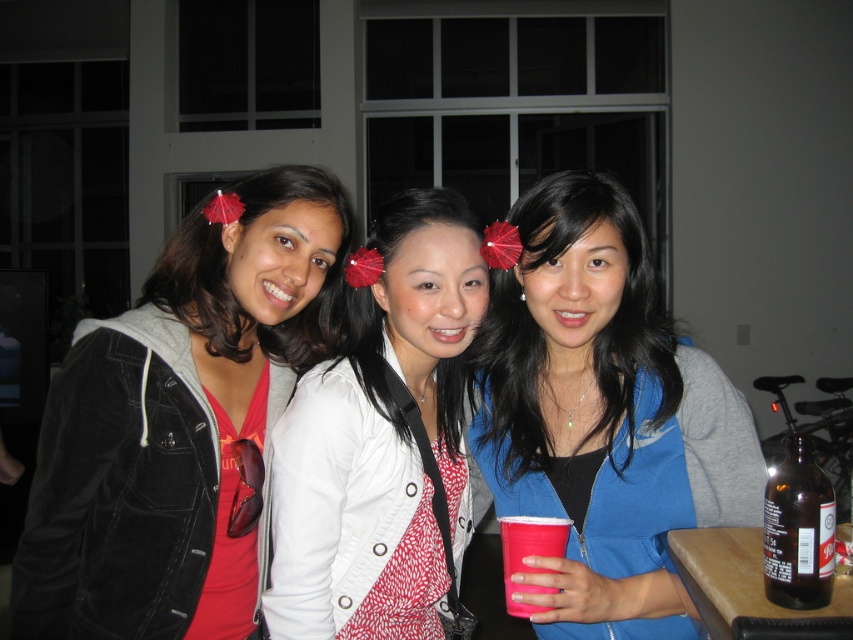
From the picture: Is matte black jacket at left bigger than white textured jacket at center?

Correct, matte black jacket at left is larger in size than white textured jacket at center.

Does point (167, 250) come in front of point (454, 388)?

Yes, it is.

This screenshot has width=853, height=640. In order to click on matte black jacket at left in this screenshot , I will do `click(178, 424)`.

Looking at this image, can you confirm if white textured jacket at center is positioned below pink plastic cup at center?

No.

Who is lower down, white textured jacket at center or pink plastic cup at center?

pink plastic cup at center

Is point (267, 627) farther from camera compared to point (505, 518)?

Yes, point (267, 627) is farther from viewer.

You are a GUI agent. You are given a task and a screenshot of the screen. Output one action in this format:
    pyautogui.click(x=<x>, y=<y>)
    Task: Click on the white textured jacket at center
    The width and height of the screenshot is (853, 640).
    Given the screenshot: What is the action you would take?
    (x=380, y=440)

Does point (274, 634) come farther from viewer compared to point (776, 518)?

Yes.

Measure the distance between white textured jacket at center and camera.

white textured jacket at center is 1.10 meters from camera.

At what (x,y) coordinates should I click in order to perform the action: click on white textured jacket at center. Please return your answer as a coordinate pair (x, y). This screenshot has width=853, height=640. Looking at the image, I should click on (380, 440).

I want to click on white textured jacket at center, so click(x=380, y=440).